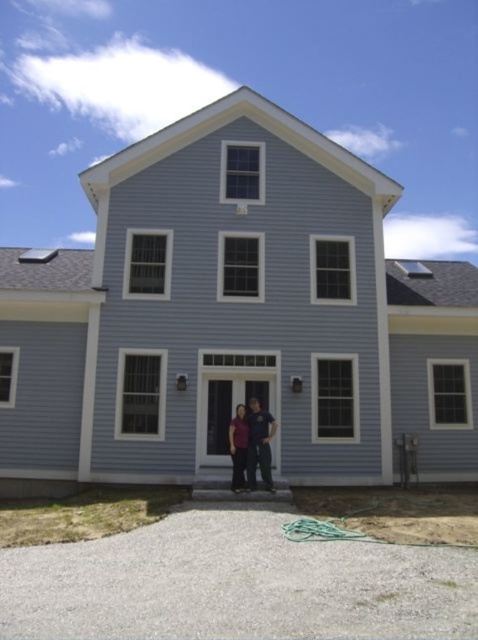
Between matte purple shirt at center and black fabric woman at center, which one has less height?

black fabric woman at center is shorter.

Based on the photo, between matte purple shirt at center and black fabric woman at center, which one appears on the right side from the viewer's perspective?

matte purple shirt at center is more to the right.

The height and width of the screenshot is (640, 478). Find the location of `matte purple shirt at center`. matte purple shirt at center is located at coordinates (250, 445).